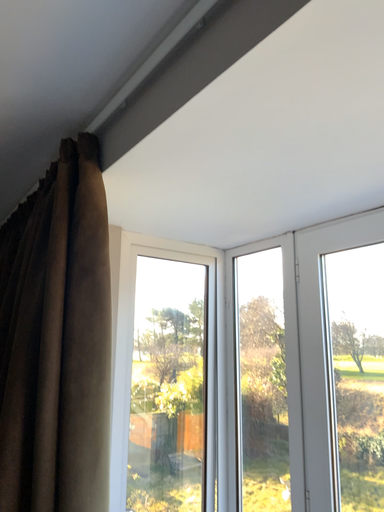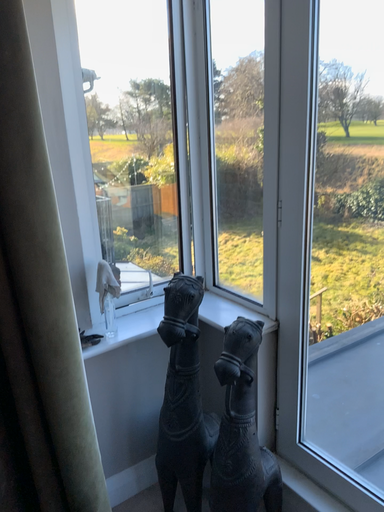
Question: How did the camera likely rotate when shooting the video?

Choices:
 (A) rotated downward
 (B) rotated upward

Answer: (A)